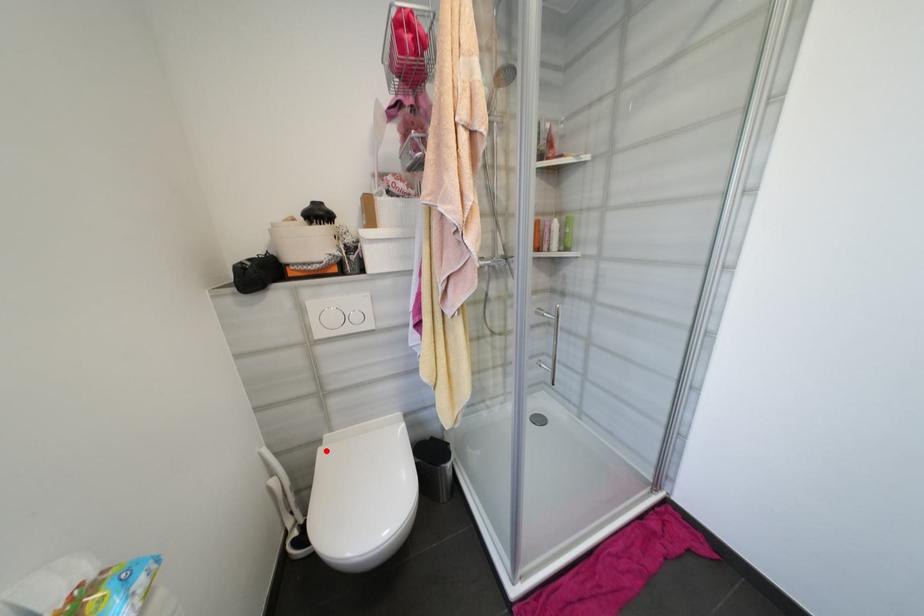
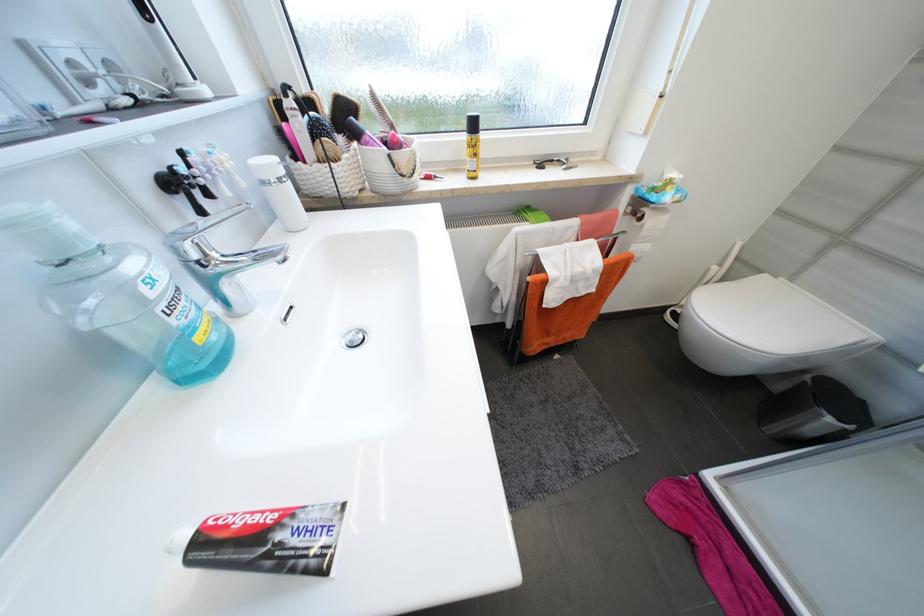
Where in the second image is the point corresponding to the highlighted location from the first image?

(771, 277)